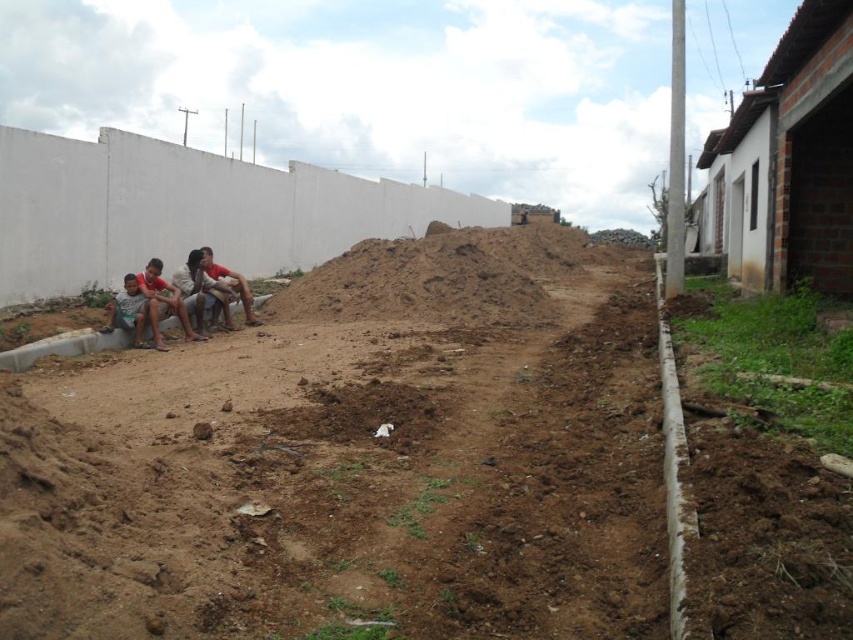
You are a delivery person trying to locate the construction workers. You see two people in the image, the light brown skin at left and the matte skin person at center left. Which one is closer to the unfinished building on the right?

The matte skin person at center left is closer to the unfinished building on the right because the light brown skin at left is positioned to the left of them, placing the matte skin person at center left nearer to the building.

You are standing at the center of the construction site and want to sit down. There is a light brown wooden bench at lower left located at point (190,294). Can you walk directly to it without crossing any obstacles?

The light brown wooden bench at lower left is located at point (190,294). Since the path between your current position and the bench isn not mentioned to have any obstacles in the provided description, you can likely walk directly to it.